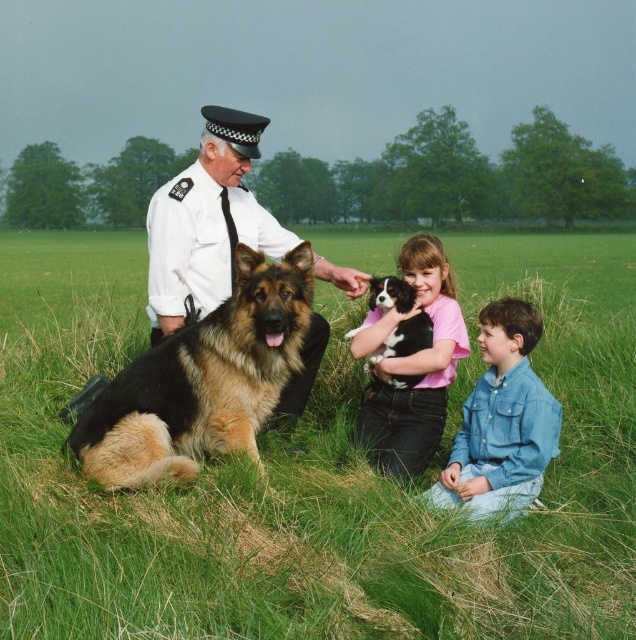
Question: Considering the relative positions of smooth white shirt at center and pink cotton shirt at center in the image provided, where is smooth white shirt at center located with respect to pink cotton shirt at center?

Choices:
 (A) above
 (B) below

Answer: (A)

Question: Does denim shirt at lower right have a larger size compared to black and white fur dog at center?

Choices:
 (A) yes
 (B) no

Answer: (A)

Question: Which point is farther from the camera taking this photo?

Choices:
 (A) (163, 352)
 (B) (15, 333)

Answer: (B)

Question: Which point is closer to the camera taking this photo?

Choices:
 (A) (384, 292)
 (B) (195, 452)

Answer: (B)

Question: Is brown and black fur at left thinner than denim shirt at lower right?

Choices:
 (A) yes
 (B) no

Answer: (B)

Question: Which point is closer to the camera?

Choices:
 (A) denim shirt at lower right
 (B) brown and black fur at left
 (C) black and white fur dog at center

Answer: (A)